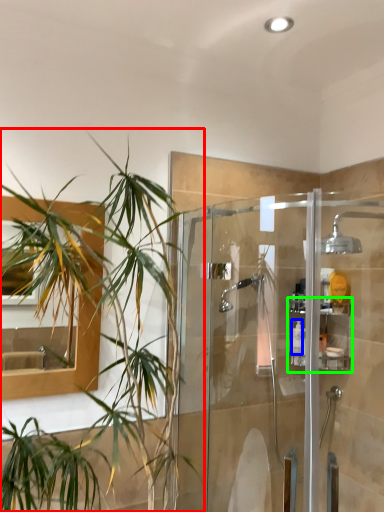
Question: Based on their relative distances, which object is nearer to houseplant (highlighted by a red box)? Choose from toiletry (highlighted by a blue box) and shelf (highlighted by a green box).

Choices:
 (A) toiletry
 (B) shelf

Answer: (B)